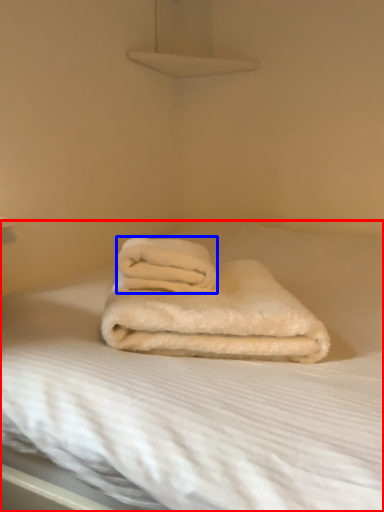
Question: Which object is further to the camera taking this photo, bed (highlighted by a red box) or towel (highlighted by a blue box)?

Choices:
 (A) bed
 (B) towel

Answer: (B)